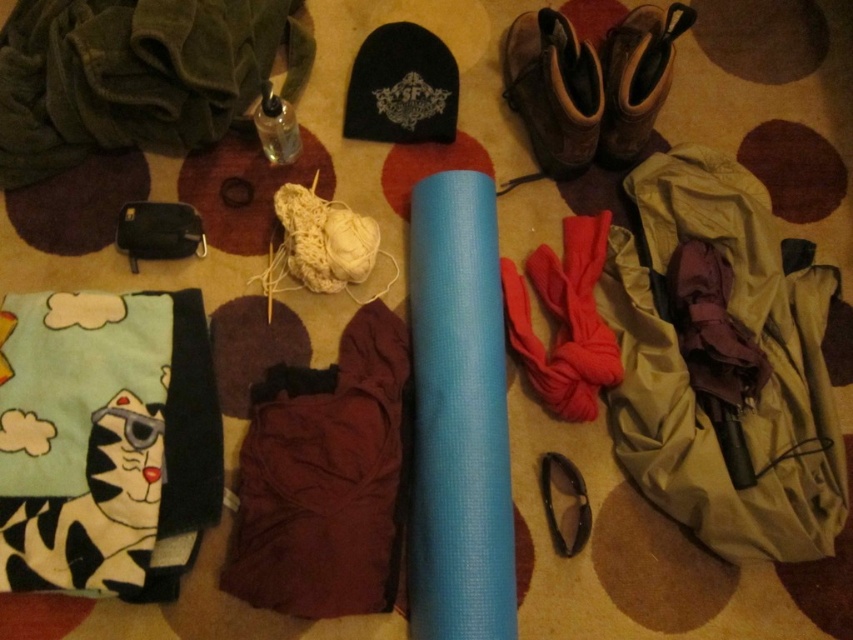
Question: Which point is closer to the camera?

Choices:
 (A) burgundy fabric at center
 (B) leather boots at upper right
 (C) brown suede boot at upper right

Answer: (A)

Question: Does leather boots at upper right come behind brown suede boot at upper right?

Choices:
 (A) yes
 (B) no

Answer: (A)

Question: Estimate the real-world distances between objects in this image. Which object is closer to the leather boots at upper right?

Choices:
 (A) brown suede boot at upper right
 (B) burgundy fabric at center

Answer: (A)

Question: Which of these objects is positioned closest to the leather boots at upper right?

Choices:
 (A) brown suede boot at upper right
 (B) burgundy fabric at center

Answer: (A)

Question: Does leather boots at upper right come in front of brown suede boot at upper right?

Choices:
 (A) no
 (B) yes

Answer: (A)

Question: Can you confirm if burgundy fabric at center is positioned to the left of leather boots at upper right?

Choices:
 (A) yes
 (B) no

Answer: (A)